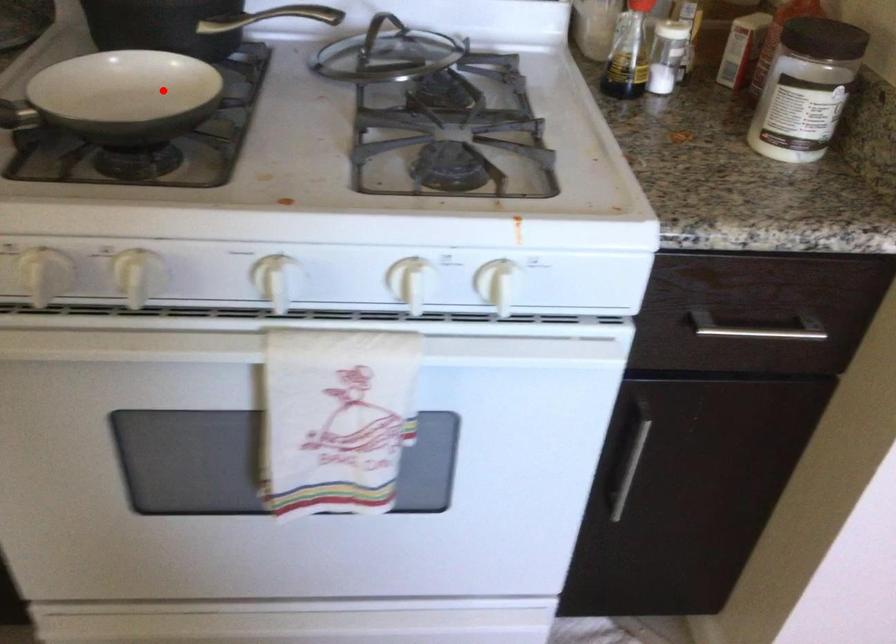
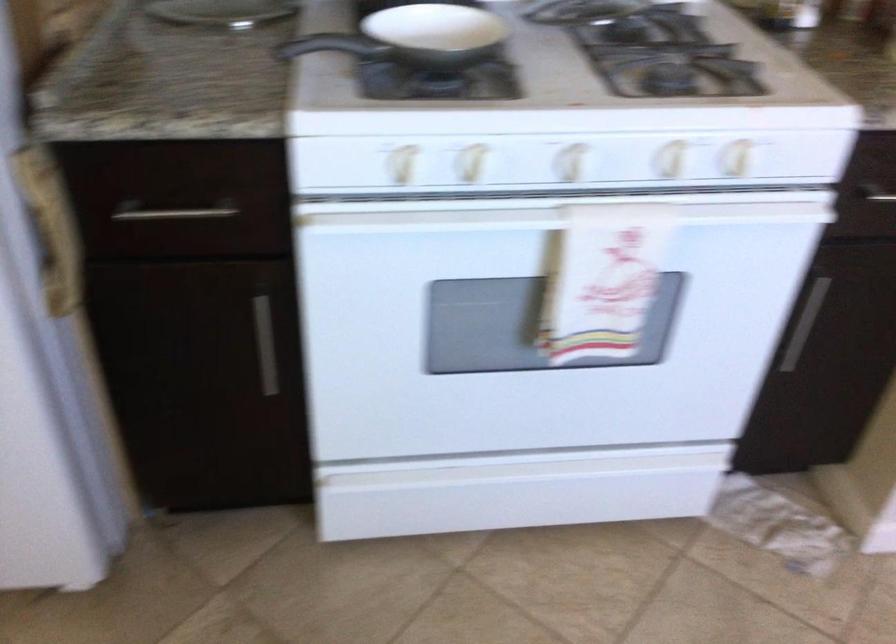
Question: I am providing you with two images of the same scene from different viewpoints. In image1, a red point is highlighted. Considering the same 3D point in image2, which of the following is correct?

Choices:
 (A) It is closer
 (B) It is farther

Answer: (B)